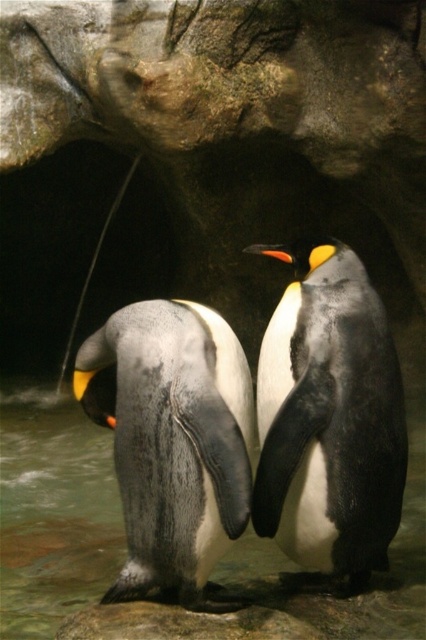
Question: Which is farther from the gray matte penguin at center?

Choices:
 (A) translucent wet rock at center
 (B) white matte penguin at center

Answer: (A)

Question: Does gray matte penguin at center appear on the left side of translucent wet rock at center?

Choices:
 (A) no
 (B) yes

Answer: (A)

Question: Which point is closer to the camera taking this photo?

Choices:
 (A) (209, 438)
 (B) (259, 545)

Answer: (A)

Question: Does white matte penguin at center have a greater width compared to translucent wet rock at center?

Choices:
 (A) yes
 (B) no

Answer: (B)

Question: Does white matte penguin at center have a greater width compared to translucent wet rock at center?

Choices:
 (A) yes
 (B) no

Answer: (B)

Question: Which of the following is the farthest from the observer?

Choices:
 (A) (293, 323)
 (B) (9, 449)
 (C) (176, 323)

Answer: (B)